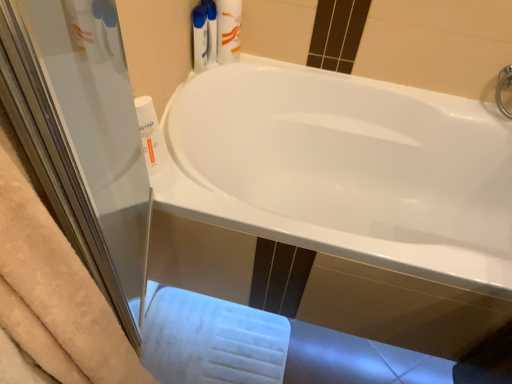
Question: Considering the relative positions of white glossy bathtub at center and white plastic bottle at left, the 2th cleaning product when ordered from back to front, in the image provided, is white glossy bathtub at center to the left or to the right of white plastic bottle at left, the 2th cleaning product when ordered from back to front,?

Choices:
 (A) right
 (B) left

Answer: (A)

Question: Considering the positions of white glossy bathtub at center and white plastic bottle at left, the first cleaning product from the bottom, in the image, is white glossy bathtub at center taller or shorter than white plastic bottle at left, the first cleaning product from the bottom,?

Choices:
 (A) tall
 (B) short

Answer: (A)

Question: Which of these objects is positioned closest to the white plastic tube at upper center?

Choices:
 (A) white plastic bottle at left, positioned as the first cleaning product in front-to-back order
 (B) white plastic bottle at upper center, which is counted as the second cleaning product, starting from the bottom
 (C) white glossy bathtub at center

Answer: (B)

Question: Which is farther from the white plastic bottle at left, positioned as the first cleaning product in front-to-back order?

Choices:
 (A) white plastic tube at upper center
 (B) white plastic bottle at upper center, which is counted as the first cleaning product, starting from the back
 (C) white glossy bathtub at center

Answer: (C)